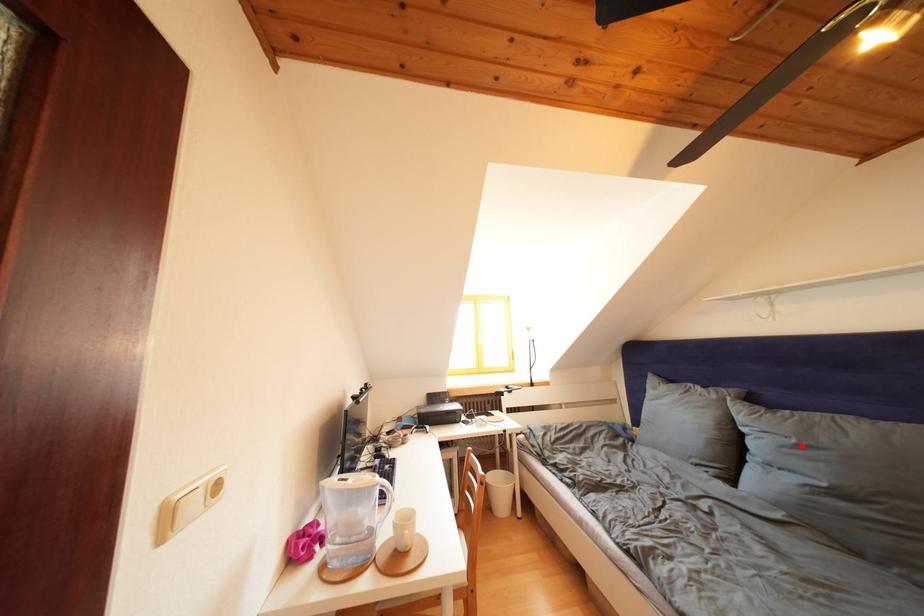
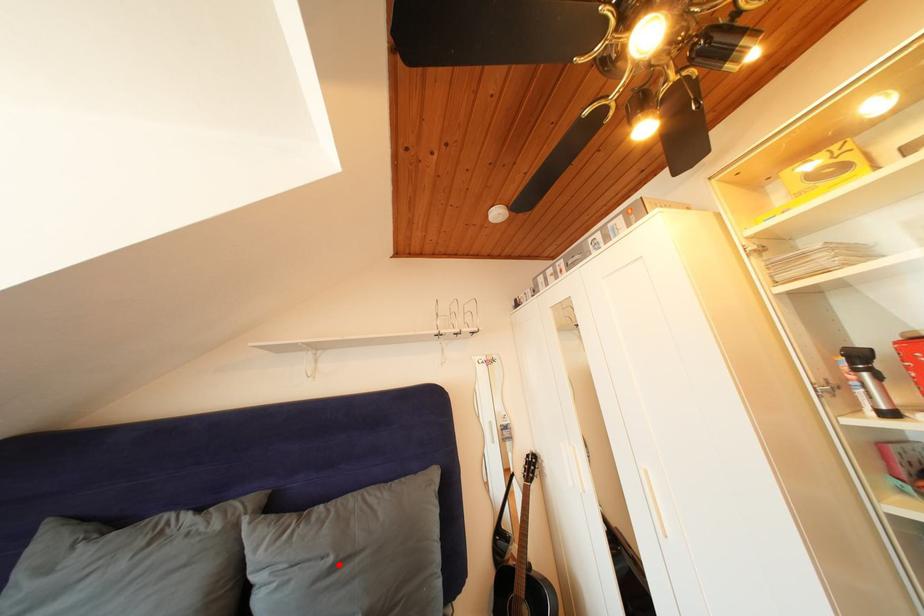
I am providing you with two images of the same scene from different viewpoints. A red point is marked on the first image and another point is marked on the second image. Are the points marked in image1 and image2 representing the same 3D position?

Yes